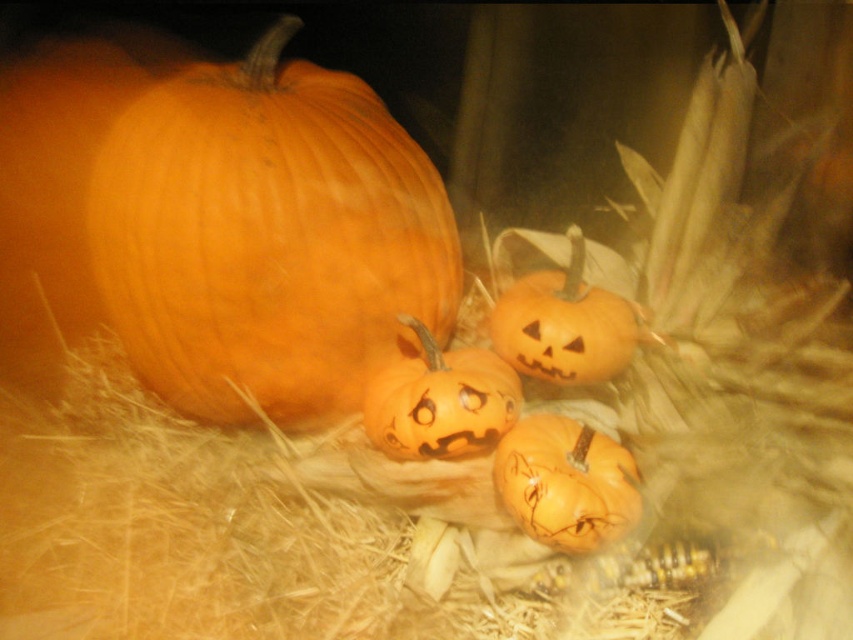
Which is in front, point (393, 232) or point (596, 477)?

Positioned in front is point (596, 477).

You are a GUI agent. You are given a task and a screenshot of the screen. Output one action in this format:
    pyautogui.click(x=<x>, y=<y>)
    Task: Click on the orange matte pumpkin at left
    Image resolution: width=853 pixels, height=640 pixels.
    Given the screenshot: What is the action you would take?
    pyautogui.click(x=265, y=236)

Does point (206, 195) come behind point (599, 433)?

No.

Locate an element on the screen. orange matte pumpkin at left is located at coordinates (265, 236).

Can you confirm if orange matte pumpkin at left is wider than orange matte pumpkin at center?

Indeed, orange matte pumpkin at left has a greater width compared to orange matte pumpkin at center.

Which is more to the right, orange matte pumpkin at left or orange matte pumpkin at center?

orange matte pumpkin at center

Is point (221, 419) farther from camera compared to point (548, 298)?

No, (221, 419) is closer to viewer.

Locate an element on the screen. The height and width of the screenshot is (640, 853). orange matte pumpkin at left is located at coordinates (265, 236).

Measure the distance between point (628, 513) and camera.

Point (628, 513) is 65.22 centimeters away from camera.

Between matte orange pumpkin at lower center and matte orange pumpkin at center, which one is positioned lower?

matte orange pumpkin at lower center

At what (x,y) coordinates should I click in order to perform the action: click on matte orange pumpkin at lower center. Please return your answer as a coordinate pair (x, y). The width and height of the screenshot is (853, 640). Looking at the image, I should click on (566, 483).

Find the location of a particular element. matte orange pumpkin at lower center is located at coordinates (566, 483).